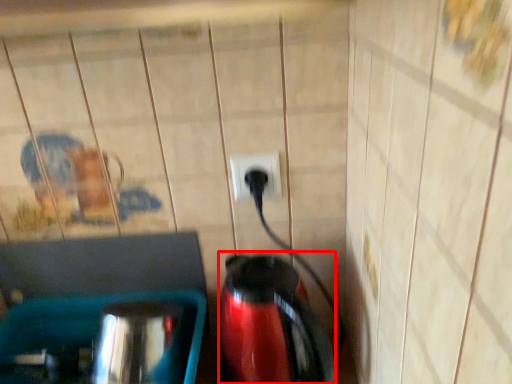
Question: Where is coffeepot (annotated by the red box) located in relation to power plugs and sockets in the image?

Choices:
 (A) right
 (B) left

Answer: (A)